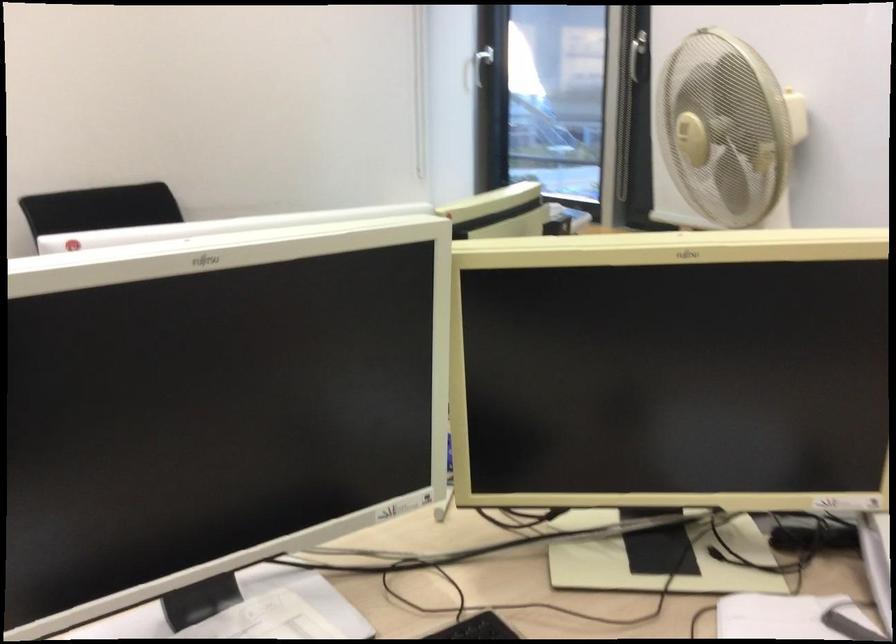
This screenshot has height=644, width=896. I want to click on scanner lid, so click(673, 371).